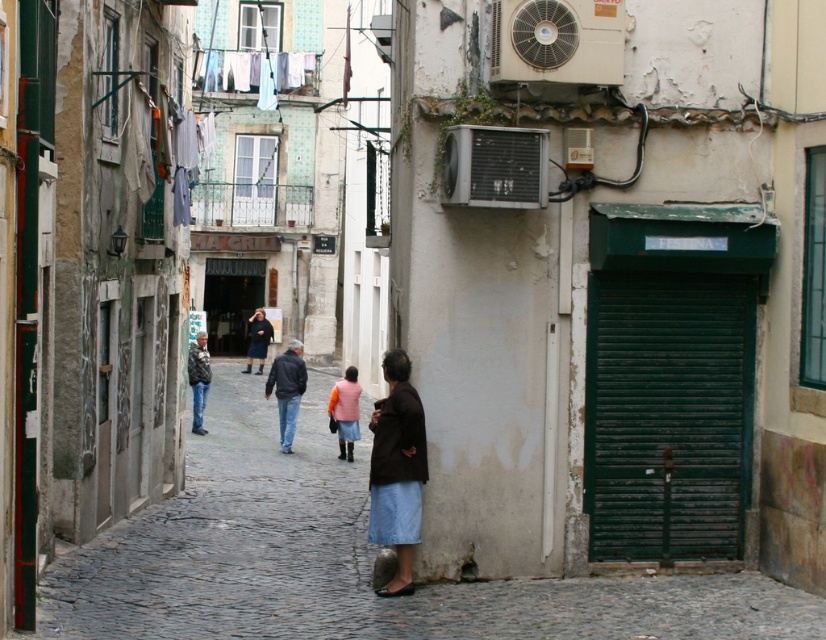
You are a photographer standing on the cobblestone street and want to capture a photo of the light blue fabric at upper center without the jeans at center appearing in the foreground. Is this possible given their positions?

The light blue fabric at upper center is positioned over the jeans at center, so the jeans at center would appear in the foreground of the photo, making it impossible to capture the light blue fabric at upper center without the jeans at center in the foreground.

You are a photographer trying to capture the entire scene of the light blue fabric at upper center and the jeans at center in one shot. Considering their widths, which object requires a wider angle to include fully in the frame?

The light blue fabric at upper center requires a wider angle to include fully in the frame because its width surpasses that of the jeans at center.